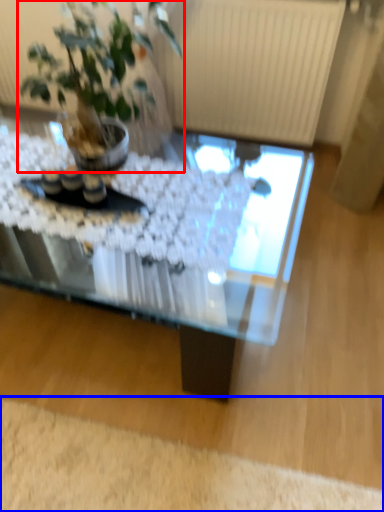
Question: Which object is further to the camera taking this photo, houseplant (highlighted by a red box) or plain (highlighted by a blue box)?

Choices:
 (A) houseplant
 (B) plain

Answer: (B)